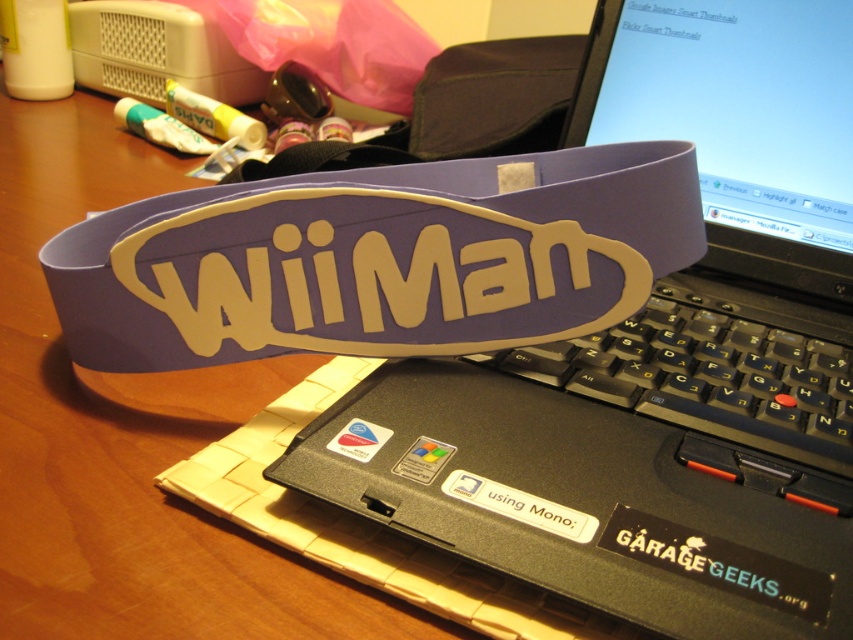
Between black plastic laptop at center and black plastic keyboard at center, which one is positioned higher?

Positioned higher is black plastic laptop at center.

Based on the photo, is black plastic laptop at center positioned in front of black plastic keyboard at center?

That is True.

Where is `black plastic laptop at center`? This screenshot has width=853, height=640. black plastic laptop at center is located at coordinates (660, 360).